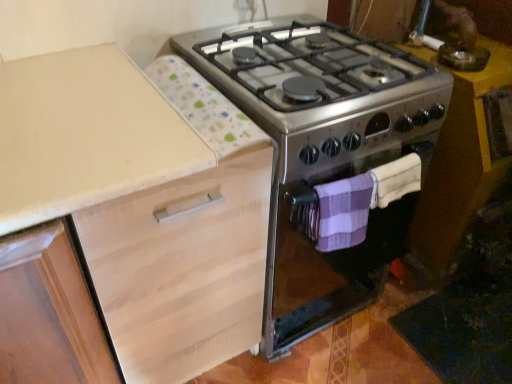
At what (x,y) coordinates should I click in order to perform the action: click on free point above metallic yellow table at right (from a real-world perspective). Please return your answer as a coordinate pair (x, y). This screenshot has width=512, height=384. Looking at the image, I should click on (466, 60).